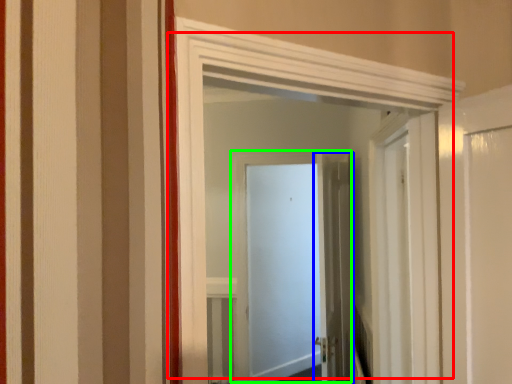
Question: Which is farther away from door (highlighted by a red box)? door (highlighted by a blue box) or door (highlighted by a green box)?

Choices:
 (A) door
 (B) door

Answer: (B)